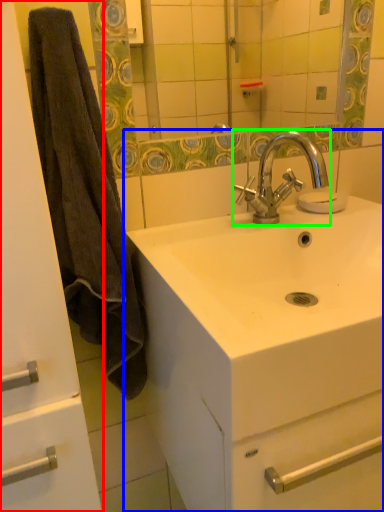
Question: Estimate the real-world distances between objects in this image. Which object is farther from bathroom cabinet (highlighted by a red box), sink (highlighted by a blue box) or tap (highlighted by a green box)?

Choices:
 (A) sink
 (B) tap

Answer: (B)